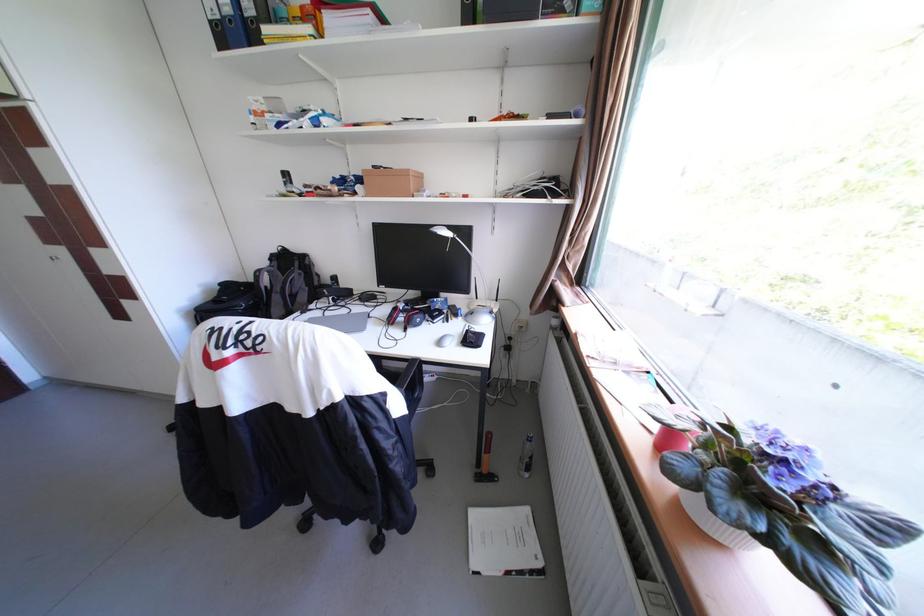
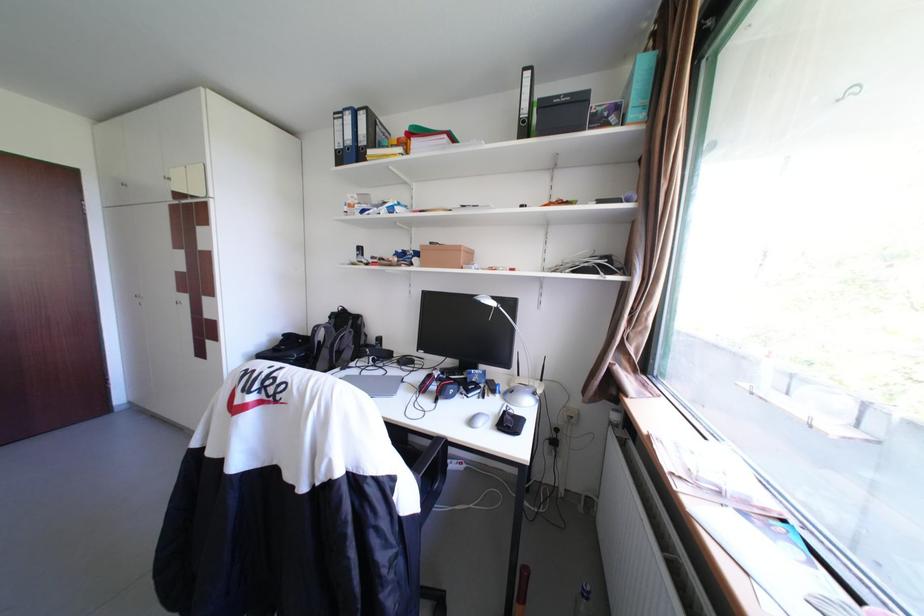
Where in the second image is the point corresponding to pixel 402 321 from the first image?

(433, 389)